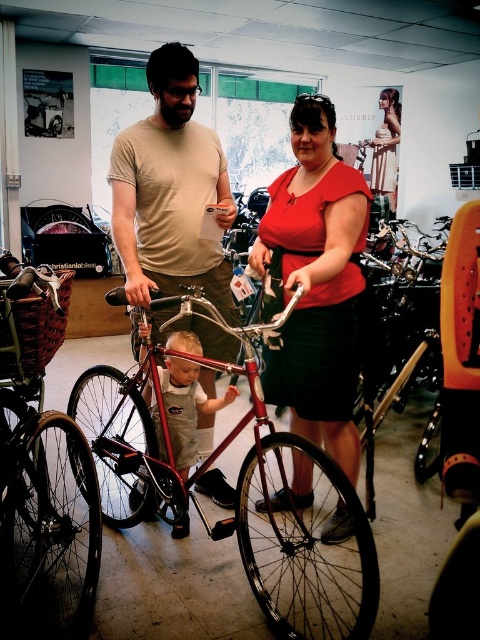
Question: Which point appears farthest from the camera in this image?

Choices:
 (A) [x=321, y=436]
 (B) [x=205, y=177]
 (C) [x=269, y=440]

Answer: (A)

Question: Is matte beige t-shirt at center smaller than light brown denim overalls at center?

Choices:
 (A) yes
 (B) no

Answer: (B)

Question: Is matte red blouse at center behind matte red dress at center?

Choices:
 (A) yes
 (B) no

Answer: (B)

Question: Is matte black bicycle at center thinner than matte beige t-shirt at center?

Choices:
 (A) yes
 (B) no

Answer: (B)

Question: Which object is closer to the camera taking this photo?

Choices:
 (A) matte red blouse at center
 (B) matte beige t-shirt at center
 (C) shiny metallic bicycle at center
 (D) matte red dress at center

Answer: (C)

Question: Which is nearer to the matte red dress at center?

Choices:
 (A) matte red blouse at center
 (B) light brown denim overalls at center
 (C) matte black bicycle at center
 (D) matte beige t-shirt at center

Answer: (D)